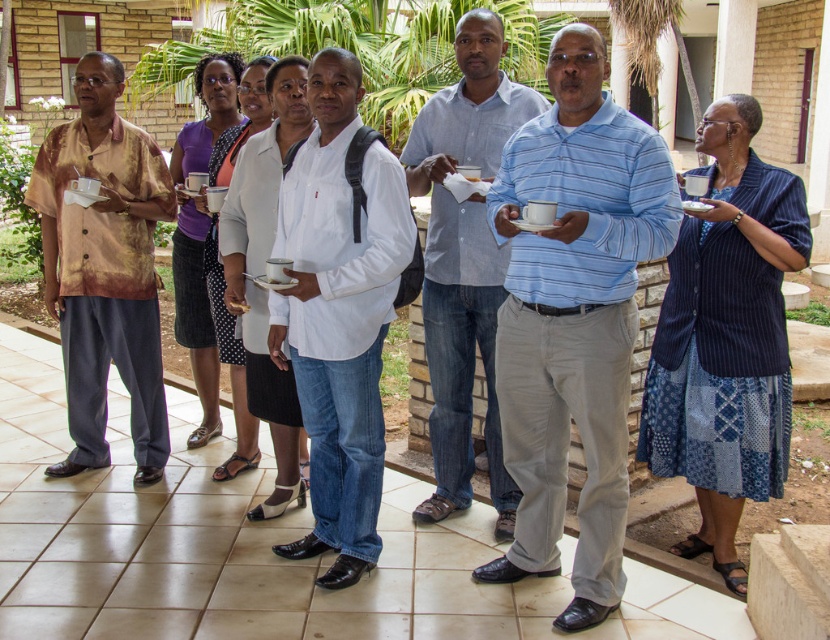
Question: Is matte brown shirt at left to the left of blue cotton shirt at center from the viewer's perspective?

Choices:
 (A) no
 (B) yes

Answer: (B)

Question: Can you confirm if white matte shirt at center is positioned below blue cotton shirt at center?

Choices:
 (A) yes
 (B) no

Answer: (A)

Question: Which of the following is the closest to the observer?

Choices:
 (A) 619,477
 (B) 340,253

Answer: (A)

Question: Which of the following is the farthest from the observer?

Choices:
 (A) (501, 484)
 (B) (374, 253)
 (C) (564, 340)
 (D) (32, 182)

Answer: (D)

Question: Does light blue striped shirt at center lie behind matte brown shirt at left?

Choices:
 (A) yes
 (B) no

Answer: (B)

Question: Among these points, which one is nearest to the camera?

Choices:
 (A) (125, 369)
 (B) (315, 67)

Answer: (B)